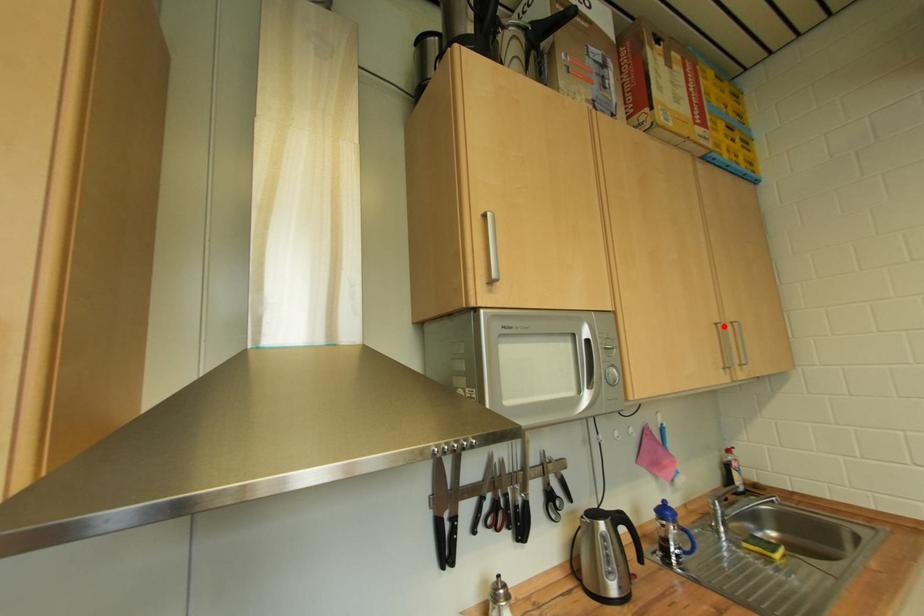
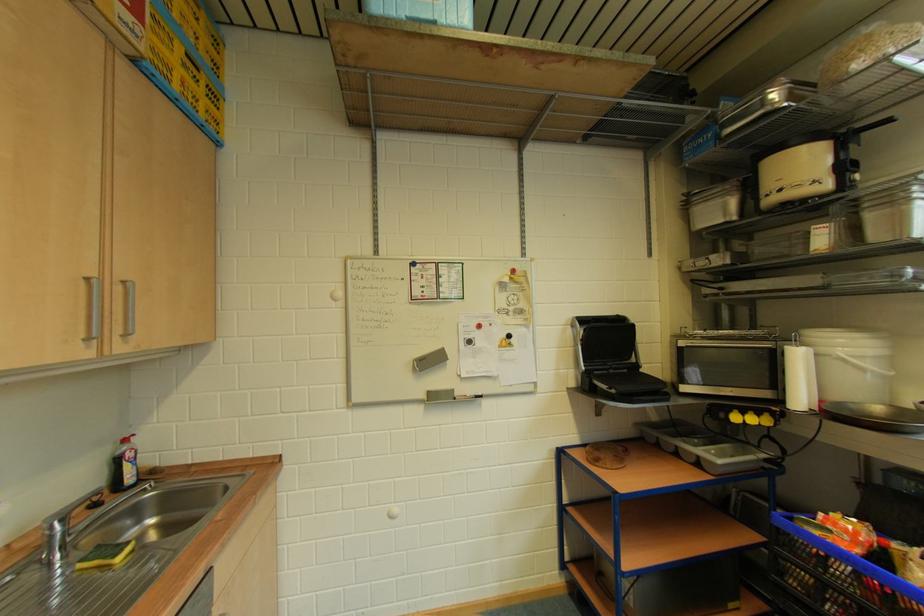
Find the pixel in the second image that matches the highlighted location in the first image.

(94, 282)